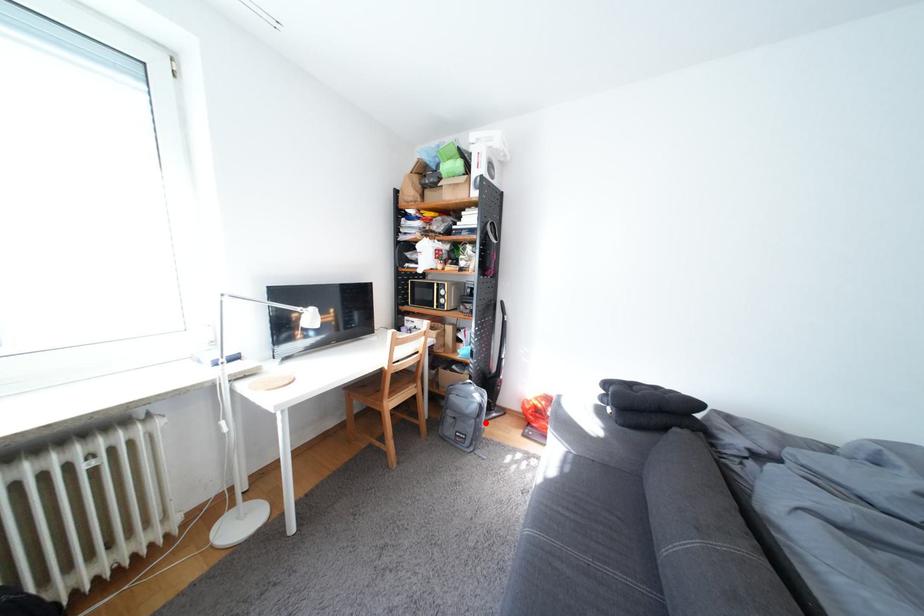
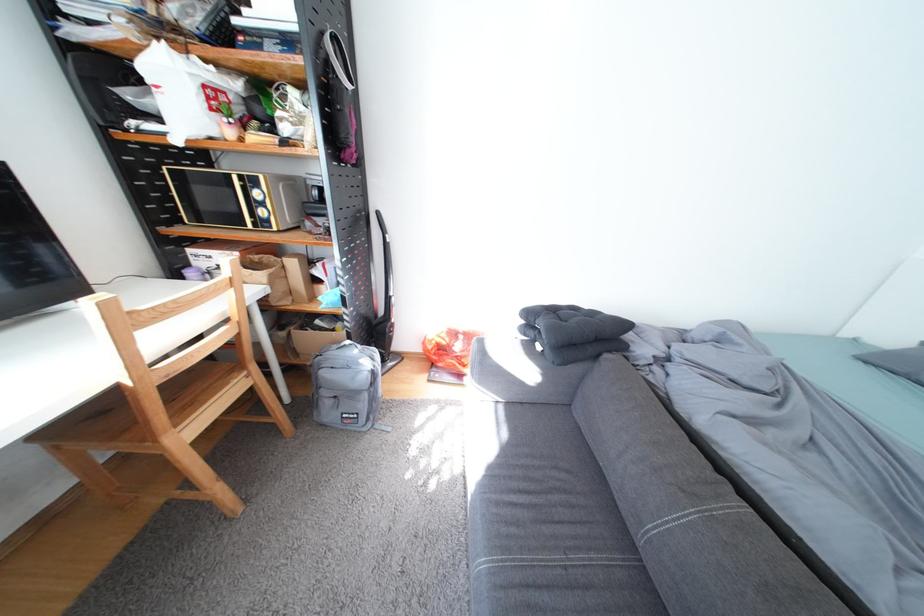
The point at the highlighted location is marked in the first image. Where is the corresponding point in the second image?

(378, 397)